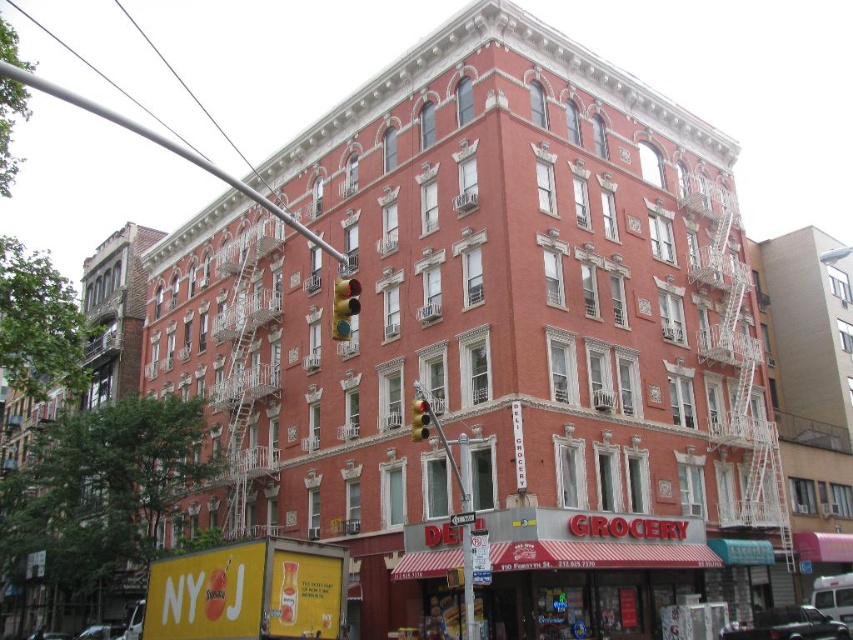
Question: Does metallic silver pole at upper left appear on the left side of yellow matte traffic light at center?

Choices:
 (A) yes
 (B) no

Answer: (A)

Question: Which point is farther to the camera?

Choices:
 (A) metallic silver pole at upper left
 (B) yellow matte traffic light at center

Answer: (B)

Question: Is metallic silver pole at upper left smaller than metallic yellow traffic light at center?

Choices:
 (A) no
 (B) yes

Answer: (A)

Question: Which point appears farthest from the camera in this image?

Choices:
 (A) (416, 410)
 (B) (253, 200)

Answer: (B)

Question: Does metallic silver pole at upper left have a greater width compared to yellow matte traffic light at center?

Choices:
 (A) no
 (B) yes

Answer: (B)

Question: Which object is the farthest from the metallic silver pole at upper left?

Choices:
 (A) yellow matte traffic light at center
 (B) metallic yellow traffic light at center

Answer: (B)